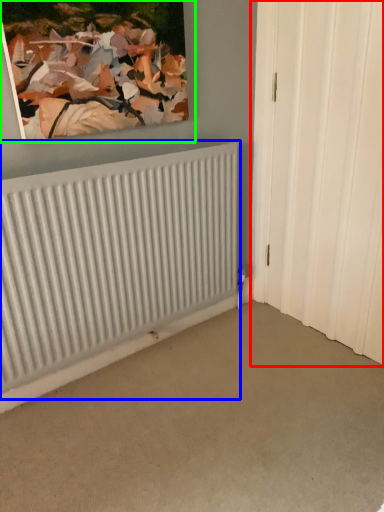
Question: Which object is the closest to the door (highlighted by a red box)? Choose among these: radiator (highlighted by a blue box) or picture frame (highlighted by a green box).

Choices:
 (A) radiator
 (B) picture frame

Answer: (A)